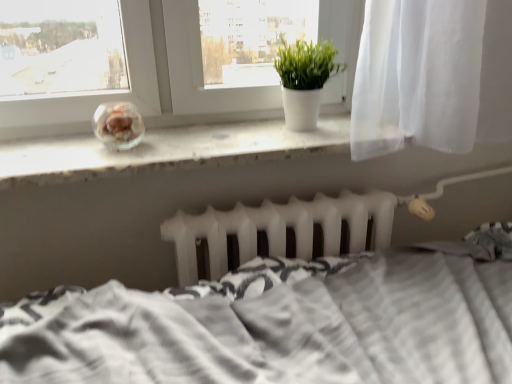
Question: Does white textured bed at center have a lesser width compared to green matte plant at center?

Choices:
 (A) no
 (B) yes

Answer: (A)

Question: Is white textured bed at center completely or partially outside of green matte plant at center?

Choices:
 (A) no
 (B) yes

Answer: (B)

Question: Is white textured bed at center aimed at green matte plant at center?

Choices:
 (A) yes
 (B) no

Answer: (B)

Question: From a real-world perspective, is white textured bed at center located higher than green matte plant at center?

Choices:
 (A) yes
 (B) no

Answer: (B)

Question: Is white textured bed at center positioned behind green matte plant at center?

Choices:
 (A) no
 (B) yes

Answer: (A)

Question: Considering their positions, is white matte radiator at center located in front of or behind green matte plant at center?

Choices:
 (A) behind
 (B) front

Answer: (B)

Question: Is point (296, 200) closer or farther from the camera than point (327, 74)?

Choices:
 (A) closer
 (B) farther

Answer: (B)

Question: From their relative heights in the image, would you say white matte radiator at center is taller or shorter than green matte plant at center?

Choices:
 (A) short
 (B) tall

Answer: (A)

Question: In the image, is white matte radiator at center on the left side or the right side of green matte plant at center?

Choices:
 (A) left
 (B) right

Answer: (A)

Question: In terms of height, does white matte radiator at center look taller or shorter compared to white textured bed at center?

Choices:
 (A) short
 (B) tall

Answer: (A)

Question: From the image's perspective, is white matte radiator at center above or below white textured bed at center?

Choices:
 (A) below
 (B) above

Answer: (B)

Question: From a real-world perspective, is white matte radiator at center above or below white textured bed at center?

Choices:
 (A) above
 (B) below

Answer: (A)

Question: Does point (188, 246) appear closer or farther from the camera than point (204, 306)?

Choices:
 (A) closer
 (B) farther

Answer: (B)

Question: From the image's perspective, is white textured bed at center positioned above or below white matte window sill at center?

Choices:
 (A) above
 (B) below

Answer: (B)

Question: Is white textured bed at center taller or shorter than white matte window sill at center?

Choices:
 (A) tall
 (B) short

Answer: (A)